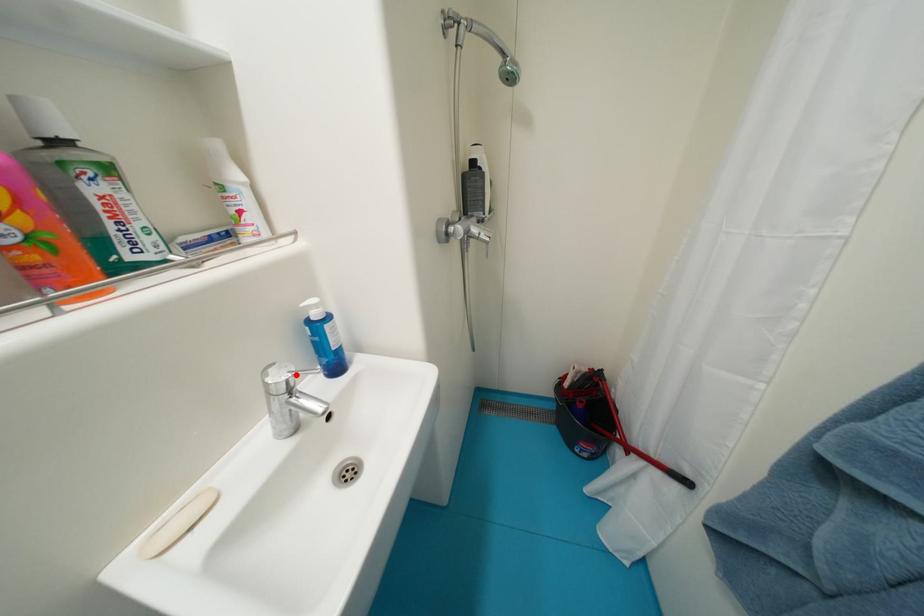
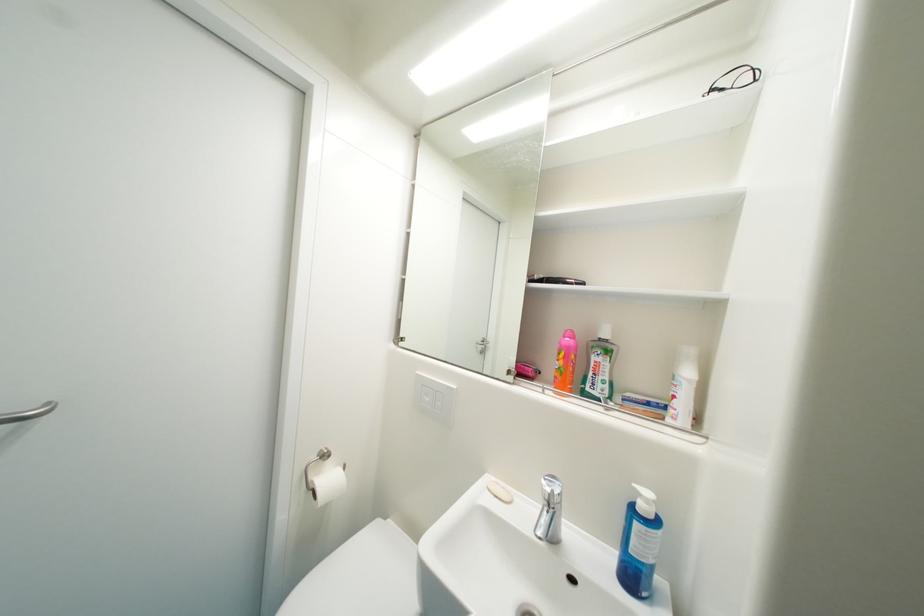
The point at the highlighted location is marked in the first image. Where is the corresponding point in the second image?

(560, 493)